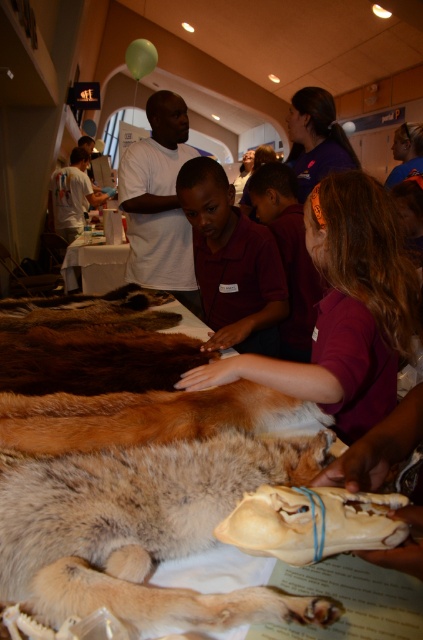
In the scene shown: You are a visitor at the museum and want to take a photo of the two points on the table. The first point is at coordinate point (71, 476) and the second is at point (271, 275). When you look from your current position, which point will appear closer to you?

Point (71, 476) is in front of point (271, 275), so it will appear closer to you.

You are a visitor at the museum and want to take a photo of the fluffy fur dog at center without the purple shirt at center appearing in the shot. How can you adjust your position to achieve this?

Since the fluffy fur dog at center is in front of the purple shirt at center, you can move to the side so that the fluffy fur dog at center blocks the view of the purple shirt at center.

You are a visitor at the museum standing in front of the table with the animal specimens. There are two points marked on the table surface. One is at coordinate point [140,458] and the other is at point [65,172]. Which point is closer to you?

Point [140,458] is closer to the viewer than point [65,172].